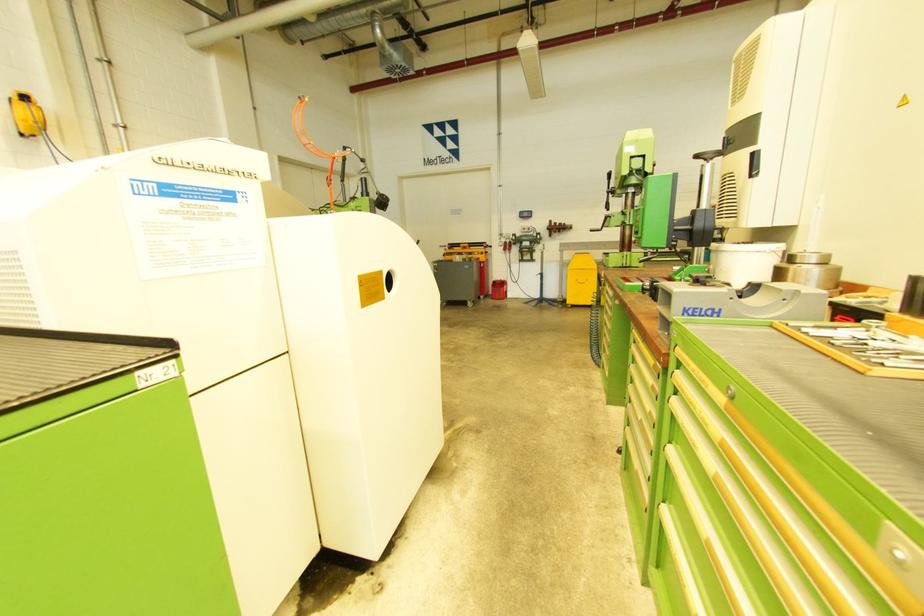
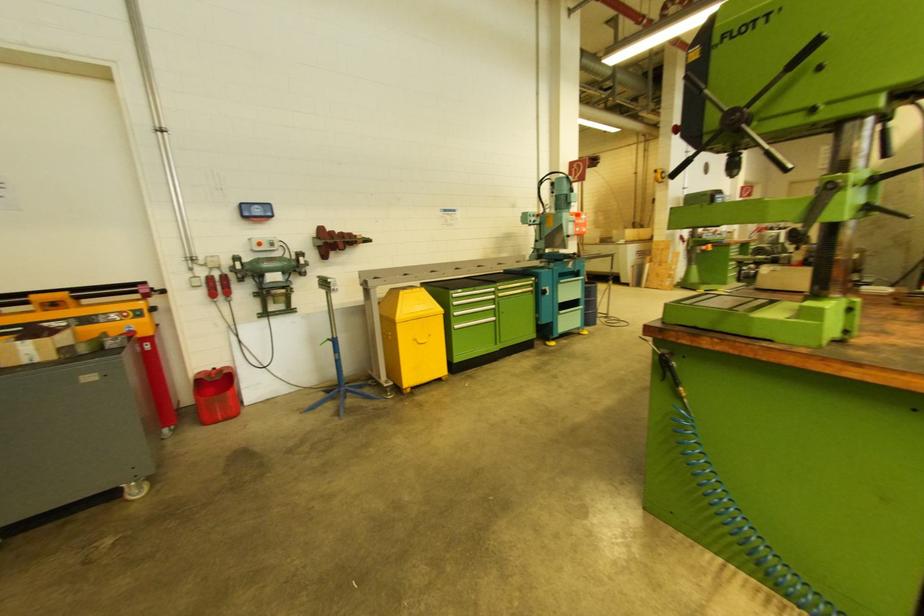
The point at [505,291] is marked in the first image. Where is the corresponding point in the second image?

(229, 394)